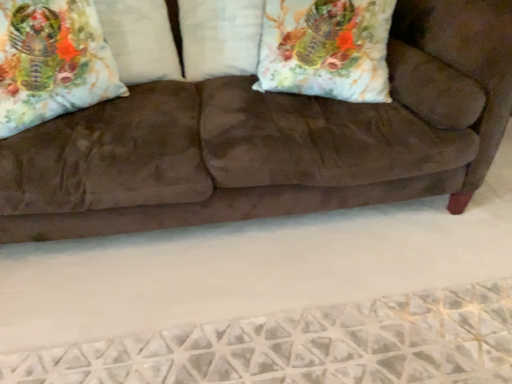
The height and width of the screenshot is (384, 512). What do you see at coordinates (271, 140) in the screenshot?
I see `brown suede couch at center` at bounding box center [271, 140].

What do you see at coordinates (52, 62) in the screenshot?
I see `floral fabric pillow at upper left, the 2th throw pillow in the right-to-left sequence` at bounding box center [52, 62].

The height and width of the screenshot is (384, 512). What are the coordinates of `floral fabric pillow at upper right, which is the first throw pillow from right to left` in the screenshot? It's located at (326, 49).

Considering the relative sizes of brown suede couch at center and floral fabric pillow at upper left, the 2th throw pillow in the right-to-left sequence, in the image provided, is brown suede couch at center taller than floral fabric pillow at upper left, the 2th throw pillow in the right-to-left sequence,?

Indeed, brown suede couch at center has a greater height compared to floral fabric pillow at upper left, the 2th throw pillow in the right-to-left sequence.

Which object is closer to the camera taking this photo, brown suede couch at center or floral fabric pillow at upper left, which appears as the first throw pillow when viewed from the left?

brown suede couch at center is closer to the camera.

Does point (496, 148) come in front of point (10, 82)?

No, it is behind (10, 82).

Find the location of a particular element. The image size is (512, 384). studio couch that appears in front of the floral fabric pillow at upper left, which appears as the first throw pillow when viewed from the left is located at coordinates click(271, 140).

From a real-world perspective, which object rests below the other?

satin white pillow at center, marked as the first pillow in a right-to-left arrangement, is physically lower.

Considering the sizes of objects satin white pillow at center, marked as the first pillow in a right-to-left arrangement, and floral fabric pillow at upper left, the 2th throw pillow in the right-to-left sequence, in the image provided, who is taller, satin white pillow at center, marked as the first pillow in a right-to-left arrangement, or floral fabric pillow at upper left, the 2th throw pillow in the right-to-left sequence,?

With more height is floral fabric pillow at upper left, the 2th throw pillow in the right-to-left sequence.

Is satin white pillow at center, marked as the first pillow in a right-to-left arrangement, thinner than floral fabric pillow at upper left, the 2th throw pillow in the right-to-left sequence?

No.

Does satin white pillow at center, marked as the first pillow in a right-to-left arrangement, have a smaller size compared to floral fabric pillow at upper left, the 2th throw pillow in the right-to-left sequence?

Yes.

Is there a large distance between satin white pillow at center, marked as the first pillow in a right-to-left arrangement, and floral fabric pillow at upper left, the second pillow in the right-to-left sequence?

Actually, satin white pillow at center, marked as the first pillow in a right-to-left arrangement, and floral fabric pillow at upper left, the second pillow in the right-to-left sequence, are a little close together.

From the image's perspective, which one is positioned lower, satin white pillow at center, marked as the first pillow in a right-to-left arrangement, or floral fabric pillow at upper left, placed as the 1th pillow when sorted from left to right?

floral fabric pillow at upper left, placed as the 1th pillow when sorted from left to right, appears lower in the image.

Considering the sizes of satin white pillow at center, marked as the second pillow in a left-to-right arrangement, and floral fabric pillow at upper left, placed as the 1th pillow when sorted from left to right, in the image, is satin white pillow at center, marked as the second pillow in a left-to-right arrangement, taller or shorter than floral fabric pillow at upper left, placed as the 1th pillow when sorted from left to right,?

satin white pillow at center, marked as the second pillow in a left-to-right arrangement, is shorter than floral fabric pillow at upper left, placed as the 1th pillow when sorted from left to right.

Is floral fabric pillow at upper left, the second pillow in the right-to-left sequence, completely or partially inside satin white pillow at center, marked as the second pillow in a left-to-right arrangement?

No, floral fabric pillow at upper left, the second pillow in the right-to-left sequence, is not a part of satin white pillow at center, marked as the second pillow in a left-to-right arrangement.

Considering the sizes of floral fabric pillow at upper left, placed as the 1th pillow when sorted from left to right, and floral fabric pillow at upper right, positioned as the second throw pillow in left-to-right order, in the image, is floral fabric pillow at upper left, placed as the 1th pillow when sorted from left to right, wider or thinner than floral fabric pillow at upper right, positioned as the second throw pillow in left-to-right order,?

Considering their sizes, floral fabric pillow at upper left, placed as the 1th pillow when sorted from left to right, looks broader than floral fabric pillow at upper right, positioned as the second throw pillow in left-to-right order.

Is floral fabric pillow at upper left, placed as the 1th pillow when sorted from left to right, in front of or behind floral fabric pillow at upper right, which is the first throw pillow from right to left, in the image?

floral fabric pillow at upper left, placed as the 1th pillow when sorted from left to right, is behind floral fabric pillow at upper right, which is the first throw pillow from right to left.

Which is more to the right, floral fabric pillow at upper left, placed as the 1th pillow when sorted from left to right, or floral fabric pillow at upper right, which is the first throw pillow from right to left?

From the viewer's perspective, floral fabric pillow at upper right, which is the first throw pillow from right to left, appears more on the right side.

Is point (146, 35) closer to viewer compared to point (290, 36)?

No, (146, 35) is behind (290, 36).

Is brown suede couch at center further to camera compared to floral fabric pillow at upper right, positioned as the second throw pillow in left-to-right order?

No, it is in front of floral fabric pillow at upper right, positioned as the second throw pillow in left-to-right order.

Is floral fabric pillow at upper right, positioned as the second throw pillow in left-to-right order, completely or partially inside brown suede couch at center?

Yes, brown suede couch at center contains floral fabric pillow at upper right, positioned as the second throw pillow in left-to-right order.

Looking at this image, considering the sizes of objects brown suede couch at center and floral fabric pillow at upper right, positioned as the second throw pillow in left-to-right order, in the image provided, who is smaller, brown suede couch at center or floral fabric pillow at upper right, positioned as the second throw pillow in left-to-right order,?

floral fabric pillow at upper right, positioned as the second throw pillow in left-to-right order, is smaller.

From the image's perspective, which is above, floral fabric pillow at upper left, the second pillow in the right-to-left sequence, or brown suede couch at center?

floral fabric pillow at upper left, the second pillow in the right-to-left sequence.

Considering the relative positions of floral fabric pillow at upper left, the second pillow in the right-to-left sequence, and brown suede couch at center in the image provided, is floral fabric pillow at upper left, the second pillow in the right-to-left sequence, to the left of brown suede couch at center from the viewer's perspective?

Yes.

This screenshot has height=384, width=512. Identify the location of studio couch located in front of the floral fabric pillow at upper left, placed as the 1th pillow when sorted from left to right. (271, 140).

Does point (297, 42) appear closer or farther from the camera than point (155, 31)?

Point (297, 42).

How far apart are floral fabric pillow at upper right, which is the first throw pillow from right to left, and floral fabric pillow at upper left, placed as the 1th pillow when sorted from left to right?

A distance of 23.76 inches exists between floral fabric pillow at upper right, which is the first throw pillow from right to left, and floral fabric pillow at upper left, placed as the 1th pillow when sorted from left to right.

Where is `pillow that appears above the floral fabric pillow at upper right, which is the first throw pillow from right to left (from a real-world perspective)`? The height and width of the screenshot is (384, 512). pillow that appears above the floral fabric pillow at upper right, which is the first throw pillow from right to left (from a real-world perspective) is located at coordinates (140, 39).

Does floral fabric pillow at upper right, which is the first throw pillow from right to left, have a lesser height compared to floral fabric pillow at upper left, placed as the 1th pillow when sorted from left to right?

Yes.

In the image, there is a floral fabric pillow at upper left, the 2th throw pillow in the right-to-left sequence. Where is `studio couch below it (from the image's perspective)`? studio couch below it (from the image's perspective) is located at coordinates (271, 140).

From the image's perspective, starting from the floral fabric pillow at upper left, the 2th throw pillow in the right-to-left sequence, which pillow is the 2nd one above? Please provide its 2D coordinates.

[(219, 37)]

When comparing their distances from satin white pillow at center, marked as the second pillow in a left-to-right arrangement, does brown suede couch at center or floral fabric pillow at upper right, positioned as the second throw pillow in left-to-right order, seem closer?

floral fabric pillow at upper right, positioned as the second throw pillow in left-to-right order, lies closer to satin white pillow at center, marked as the second pillow in a left-to-right arrangement, than the other object.

Based on their spatial positions, is floral fabric pillow at upper left, the second pillow in the right-to-left sequence, or floral fabric pillow at upper left, the 2th throw pillow in the right-to-left sequence, closer to floral fabric pillow at upper right, which is the first throw pillow from right to left?

floral fabric pillow at upper left, the second pillow in the right-to-left sequence, is positioned closer to the anchor floral fabric pillow at upper right, which is the first throw pillow from right to left.

Looking at this image, when comparing their distances from floral fabric pillow at upper left, which appears as the first throw pillow when viewed from the left, does floral fabric pillow at upper left, placed as the 1th pillow when sorted from left to right, or floral fabric pillow at upper right, positioned as the second throw pillow in left-to-right order, seem further?

floral fabric pillow at upper right, positioned as the second throw pillow in left-to-right order.

Considering their positions, is floral fabric pillow at upper left, the 2th throw pillow in the right-to-left sequence, positioned closer to satin white pillow at center, marked as the second pillow in a left-to-right arrangement, than floral fabric pillow at upper right, positioned as the second throw pillow in left-to-right order?

Among the two, floral fabric pillow at upper right, positioned as the second throw pillow in left-to-right order, is located nearer to satin white pillow at center, marked as the second pillow in a left-to-right arrangement.

Estimate the real-world distances between objects in this image. Which object is further from satin white pillow at center, marked as the second pillow in a left-to-right arrangement, floral fabric pillow at upper left, the 2th throw pillow in the right-to-left sequence, or brown suede couch at center?

floral fabric pillow at upper left, the 2th throw pillow in the right-to-left sequence.

From the image, which object appears to be nearer to floral fabric pillow at upper left, the second pillow in the right-to-left sequence, satin white pillow at center, marked as the second pillow in a left-to-right arrangement, or floral fabric pillow at upper right, which is the first throw pillow from right to left?

satin white pillow at center, marked as the second pillow in a left-to-right arrangement, lies closer to floral fabric pillow at upper left, the second pillow in the right-to-left sequence, than the other object.

Considering their positions, is floral fabric pillow at upper right, positioned as the second throw pillow in left-to-right order, positioned further to satin white pillow at center, marked as the first pillow in a right-to-left arrangement, than floral fabric pillow at upper left, which appears as the first throw pillow when viewed from the left?

floral fabric pillow at upper left, which appears as the first throw pillow when viewed from the left, lies further to satin white pillow at center, marked as the first pillow in a right-to-left arrangement, than the other object.

In the scene shown: From the image, which object appears to be farther from floral fabric pillow at upper left, the second pillow in the right-to-left sequence, floral fabric pillow at upper right, which is the first throw pillow from right to left, or satin white pillow at center, marked as the first pillow in a right-to-left arrangement?

floral fabric pillow at upper right, which is the first throw pillow from right to left, is further to floral fabric pillow at upper left, the second pillow in the right-to-left sequence.

Locate an element on the screen. studio couch situated between floral fabric pillow at upper left, the second pillow in the right-to-left sequence, and floral fabric pillow at upper right, positioned as the second throw pillow in left-to-right order, from left to right is located at coordinates tap(271, 140).

At what (x,y) coordinates should I click in order to perform the action: click on pillow located between floral fabric pillow at upper left, the second pillow in the right-to-left sequence, and floral fabric pillow at upper right, positioned as the second throw pillow in left-to-right order, in the left-right direction. Please return your answer as a coordinate pair (x, y). The image size is (512, 384). Looking at the image, I should click on (219, 37).

Where is `studio couch between floral fabric pillow at upper left, the 2th throw pillow in the right-to-left sequence, and floral fabric pillow at upper right, which is the first throw pillow from right to left`? This screenshot has height=384, width=512. studio couch between floral fabric pillow at upper left, the 2th throw pillow in the right-to-left sequence, and floral fabric pillow at upper right, which is the first throw pillow from right to left is located at coordinates point(271,140).

At what (x,y) coordinates should I click in order to perform the action: click on pillow positioned between brown suede couch at center and satin white pillow at center, marked as the first pillow in a right-to-left arrangement, from near to far. Please return your answer as a coordinate pair (x, y). This screenshot has width=512, height=384. Looking at the image, I should click on (140, 39).